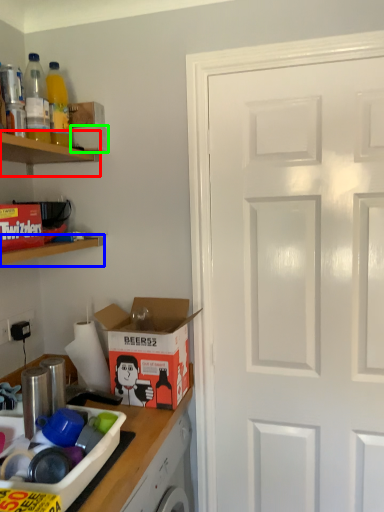
Question: Which object is the farthest from shelf (highlighted by a red box)? Choose among these: shelf (highlighted by a blue box) or box (highlighted by a green box).

Choices:
 (A) shelf
 (B) box

Answer: (A)